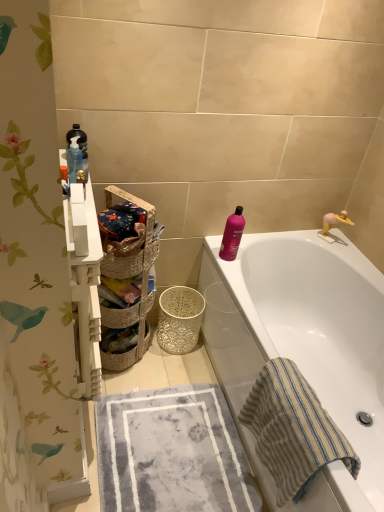
Question: Considering the relative sizes of pink glossy bottle at upper right, the 1th cleaning product from the right, and white glossy bathtub at upper right in the image provided, is pink glossy bottle at upper right, the 1th cleaning product from the right, shorter than white glossy bathtub at upper right?

Choices:
 (A) yes
 (B) no

Answer: (A)

Question: From a real-world perspective, is pink glossy bottle at upper right, which is the 2th cleaning product from front to back, on white glossy bathtub at upper right?

Choices:
 (A) yes
 (B) no

Answer: (A)

Question: Can you confirm if pink glossy bottle at upper right, the 1th cleaning product from the right, is smaller than white glossy bathtub at upper right?

Choices:
 (A) yes
 (B) no

Answer: (A)

Question: Can you confirm if pink glossy bottle at upper right, the 1th cleaning product from the right, is bigger than white glossy bathtub at upper right?

Choices:
 (A) yes
 (B) no

Answer: (B)

Question: Is pink glossy bottle at upper right, positioned as the 2th cleaning product in top-to-bottom order, surrounding white glossy bathtub at upper right?

Choices:
 (A) no
 (B) yes

Answer: (A)

Question: From the image's perspective, is pink glossy bottle at upper right, which appears as the first cleaning product when ordered from the bottom, under white glossy bathtub at upper right?

Choices:
 (A) no
 (B) yes

Answer: (A)

Question: Can you confirm if beige striped towel at lower right, which ranks as the first beach towel in right-to-left order, is positioned to the left of translucent plastic bottles at upper left, which is counted as the second cleaning product, starting from the bottom?

Choices:
 (A) yes
 (B) no

Answer: (B)

Question: Can you confirm if beige striped towel at lower right, which ranks as the first beach towel in right-to-left order, is shorter than translucent plastic bottles at upper left, placed as the 2th cleaning product when sorted from back to front?

Choices:
 (A) no
 (B) yes

Answer: (A)

Question: Could you tell me if beige striped towel at lower right, the second beach towel viewed from the left, is turned towards translucent plastic bottles at upper left, which is counted as the second cleaning product, starting from the bottom?

Choices:
 (A) no
 (B) yes

Answer: (A)

Question: Is beige striped towel at lower right, the second beach towel viewed from the left, positioned before translucent plastic bottles at upper left, marked as the 1th cleaning product in a front-to-back arrangement?

Choices:
 (A) yes
 (B) no

Answer: (A)

Question: Can you confirm if beige striped towel at lower right, the second beach towel viewed from the left, is bigger than translucent plastic bottles at upper left, which is counted as the second cleaning product, starting from the bottom?

Choices:
 (A) yes
 (B) no

Answer: (A)

Question: Can you confirm if beige striped towel at lower right, the second beach towel viewed from the left, is wider than translucent plastic bottles at upper left, marked as the 1th cleaning product in a front-to-back arrangement?

Choices:
 (A) yes
 (B) no

Answer: (A)

Question: Is woven brown basket at center, arranged as the 2th basket when viewed from the front, thinner than woven natural basket at center, arranged as the second basket when viewed from the back?

Choices:
 (A) no
 (B) yes

Answer: (A)